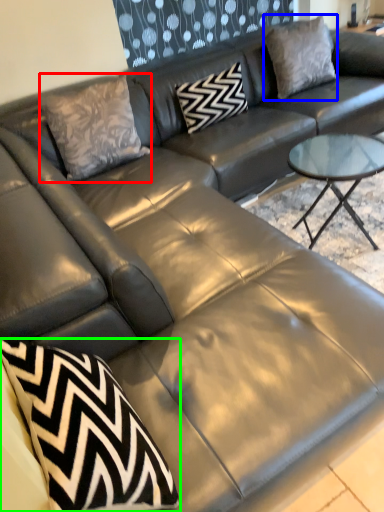
Question: Which object is positioned farthest from throw pillow (highlighted by a red box)? Select from pillow (highlighted by a blue box) and throw pillow (highlighted by a green box).

Choices:
 (A) pillow
 (B) throw pillow

Answer: (B)